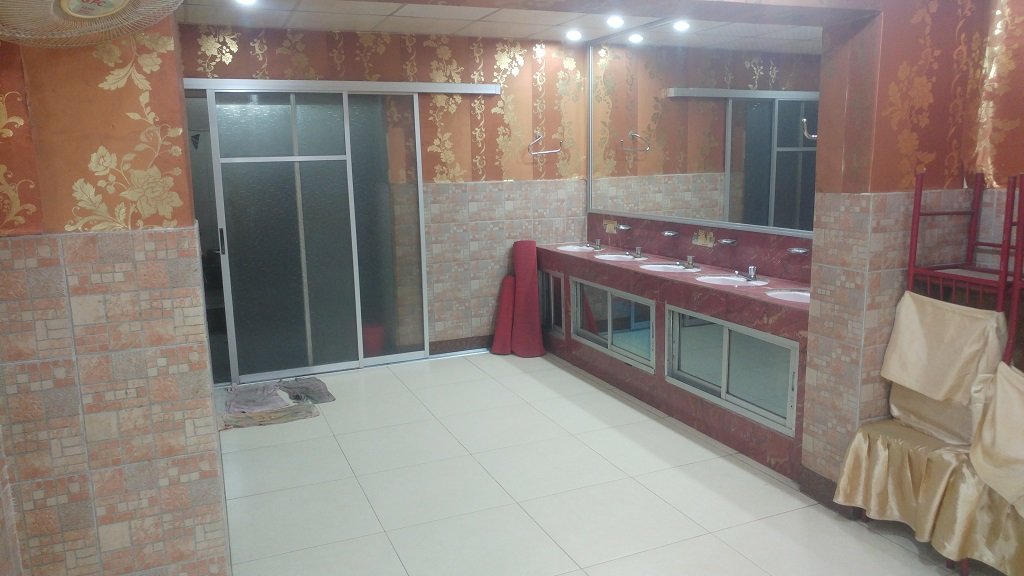
This screenshot has height=576, width=1024. I want to click on reflection of ceiling, so click(x=780, y=39).